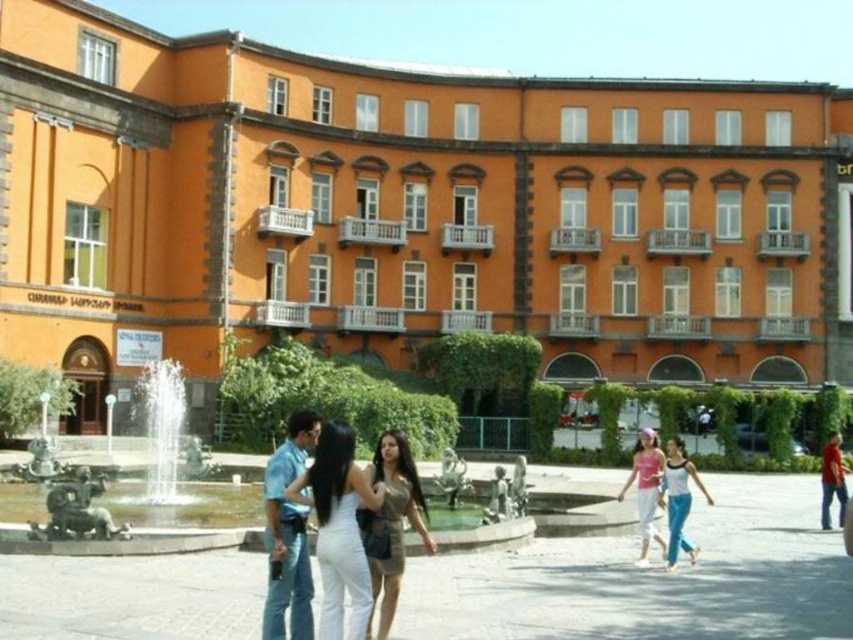
Consider the image. You are an architect evaluating the urban space. The city council wants to ensure that the shiny metallic fountain at center is not overshadowed by the orange matte building at upper center. Based on the scene, is the fountain visually balanced in size relative to the building?

The orange matte building at upper center is larger in size than the shiny metallic fountain at center, so the fountain is smaller and may appear visually balanced as it does not overpower the building.

You are an artist standing in the plaza in front of the orange building. You notice two people wearing a white cotton tank top at center and a pink fabric dress at center. Which person is positioned to the right of the other?

The white cotton tank top at center is to the right of the pink fabric dress at center.

You are standing in the plaza in front of the orange building. Looking up, you notice a specific point marked at coordinates (407, 211). What does this point indicate?

The point at (407, 211) indicates the orange matte building at upper center.